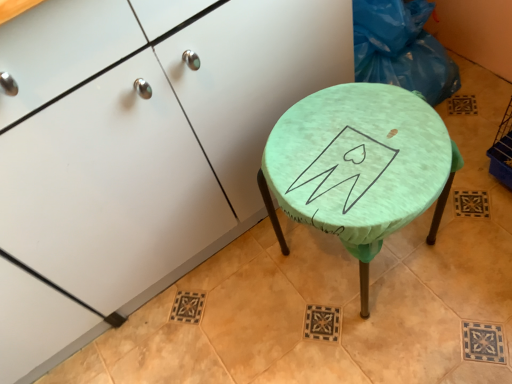
Question: Considering the positions of blue plastic bag at upper right and matte white cabinet at center in the image, is blue plastic bag at upper right taller or shorter than matte white cabinet at center?

Choices:
 (A) tall
 (B) short

Answer: (B)

Question: In terms of size, does blue plastic bag at upper right appear bigger or smaller than matte white cabinet at center?

Choices:
 (A) big
 (B) small

Answer: (B)

Question: Which of these objects is positioned farthest from the green fabric-covered stool at center?

Choices:
 (A) matte white cabinet at center
 (B) blue plastic bag at upper right

Answer: (B)

Question: Which is nearer to the blue plastic bag at upper right?

Choices:
 (A) matte white cabinet at center
 (B) green fabric-covered stool at center

Answer: (B)